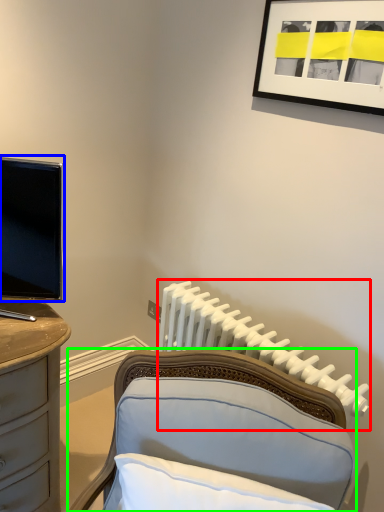
Question: Based on their relative distances, which object is nearer to radiator (highlighted by a red box)? Choose from television (highlighted by a blue box) and furniture (highlighted by a green box).

Choices:
 (A) television
 (B) furniture

Answer: (B)